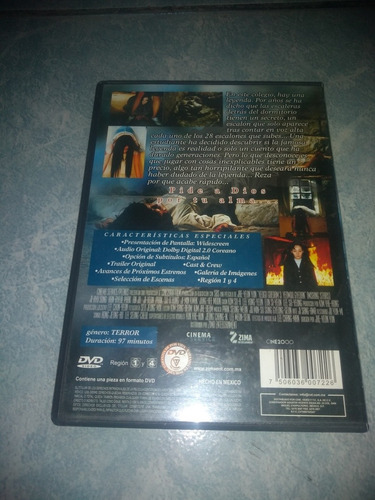
Locate an element on the screen. small blue box is located at coordinates (141, 337).